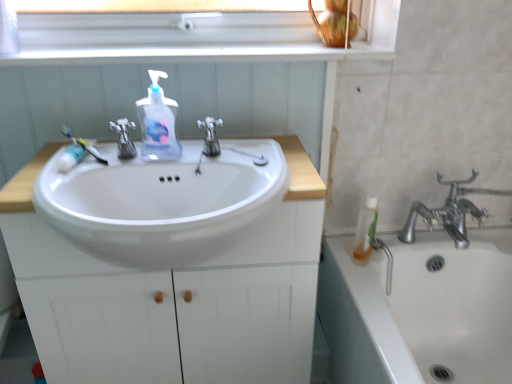
What do you see at coordinates (158, 122) in the screenshot?
I see `translucent plastic soap dispenser at center` at bounding box center [158, 122].

I want to click on translucent plastic soap dispenser at center, so click(x=158, y=122).

I want to click on satin nickel faucet at center, placed as the second tap when sorted from right to left, so point(124,138).

Describe the element at coordinates (166, 37) in the screenshot. I see `white plastic window frame at upper center` at that location.

Describe the element at coordinates (366, 228) in the screenshot. I see `translucent plastic bottle at right` at that location.

The image size is (512, 384). What are the coordinates of `white plastic toothbrush at left` in the screenshot? It's located at (83, 144).

The width and height of the screenshot is (512, 384). I want to click on translucent plastic soap dispenser at center, so click(158, 122).

Does translucent plastic soap dispenser at center lie in front of satin nickel faucet at center, placed as the second tap when sorted from right to left?

No.

Which object is positioned more to the right, translucent plastic soap dispenser at center or satin nickel faucet at center, acting as the first tap starting from the left?

Positioned to the right is translucent plastic soap dispenser at center.

From a real-world perspective, is translucent plastic soap dispenser at center positioned under satin nickel faucet at center, placed as the second tap when sorted from right to left, based on gravity?

Incorrect, from a real-world perspective, translucent plastic soap dispenser at center is higher than satin nickel faucet at center, placed as the second tap when sorted from right to left.

Can you confirm if silver metallic faucet at center, which ranks as the second tap in left-to-right order, is shorter than translucent plastic soap dispenser at center?

Indeed, silver metallic faucet at center, which ranks as the second tap in left-to-right order, has a lesser height compared to translucent plastic soap dispenser at center.

Would you say silver metallic faucet at center, which ranks as the second tap in left-to-right order, is inside or outside translucent plastic soap dispenser at center?

silver metallic faucet at center, which ranks as the second tap in left-to-right order, lies outside translucent plastic soap dispenser at center.

From the image's perspective, is silver metallic faucet at center, which ranks as the second tap in left-to-right order, on translucent plastic soap dispenser at center?

No, from the image's perspective, silver metallic faucet at center, which ranks as the second tap in left-to-right order, is not over translucent plastic soap dispenser at center.

In the image, is silver metallic faucet at center, acting as the 1th tap starting from the right, on the left side or the right side of translucent plastic soap dispenser at center?

Clearly, silver metallic faucet at center, acting as the 1th tap starting from the right, is on the right of translucent plastic soap dispenser at center in the image.

You are a GUI agent. You are given a task and a screenshot of the screen. Output one action in this format:
    pyautogui.click(x=<x>, y=<y>)
    Task: Click on the mouthwash lying behind the white glossy window sill at upper center
    
    Given the screenshot: What is the action you would take?
    pyautogui.click(x=366, y=228)

How different are the orientations of translucent plastic bottle at right and white glossy window sill at upper center in degrees?

48.7 degrees separate the facing orientations of translucent plastic bottle at right and white glossy window sill at upper center.

Could you tell me if translucent plastic bottle at right is facing white glossy window sill at upper center?

No, translucent plastic bottle at right is not turned towards white glossy window sill at upper center.

Is the depth of translucent plastic bottle at right greater than that of white glossy window sill at upper center?

Yes, it is behind white glossy window sill at upper center.

Can you confirm if white plastic window frame at upper center is taller than translucent plastic soap dispenser at center?

No, white plastic window frame at upper center is not taller than translucent plastic soap dispenser at center.

Is white plastic window frame at upper center looking in the opposite direction of translucent plastic soap dispenser at center?

No, translucent plastic soap dispenser at center is not at the back of white plastic window frame at upper center.

Is point (391, 11) closer or farther from the camera than point (156, 129)?

Clearly, point (391, 11) is more distant from the camera than point (156, 129).

Is point (355, 246) in front of point (261, 181)?

That is False.

Looking at the image, does translucent plastic bottle at right seem bigger or smaller compared to white glossy cabinet at center?

Clearly, translucent plastic bottle at right is smaller in size than white glossy cabinet at center.

From the picture: From a real-world perspective, which object rests below the other?

white glossy cabinet at center is physically lower.

From the image's perspective, is translucent plastic bottle at right located beneath white glossy cabinet at center?

No, from the image's perspective, translucent plastic bottle at right is not below white glossy cabinet at center.

From the image's perspective, which object appears higher, translucent plastic bottle at right or silver metallic faucet at center, acting as the 1th tap starting from the right?

silver metallic faucet at center, acting as the 1th tap starting from the right.

How distant is translucent plastic bottle at right from silver metallic faucet at center, acting as the 1th tap starting from the right?

translucent plastic bottle at right is 21.68 inches away from silver metallic faucet at center, acting as the 1th tap starting from the right.

In the scene shown: Can you confirm if translucent plastic bottle at right is shorter than silver metallic faucet at center, acting as the 1th tap starting from the right?

Incorrect, the height of translucent plastic bottle at right does not fall short of that of silver metallic faucet at center, acting as the 1th tap starting from the right.

Is point (362, 207) positioned before point (211, 120)?

No, (362, 207) is further to viewer.

From the image's perspective, is white glossy cabinet at center under silver metallic faucet at center, which ranks as the second tap in left-to-right order?

Indeed, from the image's perspective, white glossy cabinet at center is shown beneath silver metallic faucet at center, which ranks as the second tap in left-to-right order.

How distant is white glossy cabinet at center from silver metallic faucet at center, which ranks as the second tap in left-to-right order?

white glossy cabinet at center is 14.18 inches away from silver metallic faucet at center, which ranks as the second tap in left-to-right order.

Between white glossy cabinet at center and silver metallic faucet at center, which ranks as the second tap in left-to-right order, which one has larger size?

Bigger between the two is white glossy cabinet at center.

Is silver metallic faucet at center, which ranks as the second tap in left-to-right order, located within white glossy cabinet at center?

No, white glossy cabinet at center does not contain silver metallic faucet at center, which ranks as the second tap in left-to-right order.

Find the location of a particular element. Image resolution: width=512 pixels, height=384 pixels. cleaning product located above the satin nickel faucet at center, acting as the first tap starting from the left (from a real-world perspective) is located at coordinates (158, 122).

Where is `the 1st tap below the translucent plastic soap dispenser at center (from a real-world perspective)`? the 1st tap below the translucent plastic soap dispenser at center (from a real-world perspective) is located at coordinates (210, 136).

Which object lies nearer to the anchor point silver metallic faucet at center, which ranks as the second tap in left-to-right order, white glossy cabinet at center or white plastic toothbrush at left?

white plastic toothbrush at left is closer to silver metallic faucet at center, which ranks as the second tap in left-to-right order.

Looking at the image, which one is located closer to translucent plastic soap dispenser at center, translucent plastic bottle at right or silver metallic faucet at center, which ranks as the second tap in left-to-right order?

silver metallic faucet at center, which ranks as the second tap in left-to-right order.

Based on their spatial positions, is white glossy window sill at upper center or white glossy cabinet at center further from silver metallic faucet at center, which ranks as the second tap in left-to-right order?

white glossy cabinet at center is positioned further to the anchor silver metallic faucet at center, which ranks as the second tap in left-to-right order.

Based on their spatial positions, is silver metallic faucet at center, acting as the 1th tap starting from the right, or white plastic window frame at upper center further from translucent plastic soap dispenser at center?

Among the two, white plastic window frame at upper center is located further to translucent plastic soap dispenser at center.

Considering their positions, is white plastic toothbrush at left positioned closer to satin nickel faucet at center, acting as the first tap starting from the left, than white glossy window sill at upper center?

white plastic toothbrush at left.

Considering their positions, is white glossy cabinet at center positioned further to white plastic window frame at upper center than translucent plastic bottle at right?

translucent plastic bottle at right.

Looking at the image, which one is located closer to translucent plastic bottle at right, white glossy cabinet at center or translucent plastic soap dispenser at center?

white glossy cabinet at center lies closer to translucent plastic bottle at right than the other object.

Which object lies nearer to the anchor point satin nickel faucet at center, placed as the second tap when sorted from right to left, translucent plastic soap dispenser at center or white glossy window sill at upper center?

The object closer to satin nickel faucet at center, placed as the second tap when sorted from right to left, is translucent plastic soap dispenser at center.

Locate an element on the screen. mouthwash between white plastic window frame at upper center and white glossy cabinet at center vertically is located at coordinates (366, 228).

Identify the location of tap located between white glossy window sill at upper center and translucent plastic bottle at right in the left-right direction. (210, 136).

Locate an element on the screen. window sill that lies between white plastic window frame at upper center and white plastic toothbrush at left from top to bottom is located at coordinates (197, 54).

Image resolution: width=512 pixels, height=384 pixels. Identify the location of window frame between white plastic toothbrush at left and translucent plastic bottle at right. (166, 37).